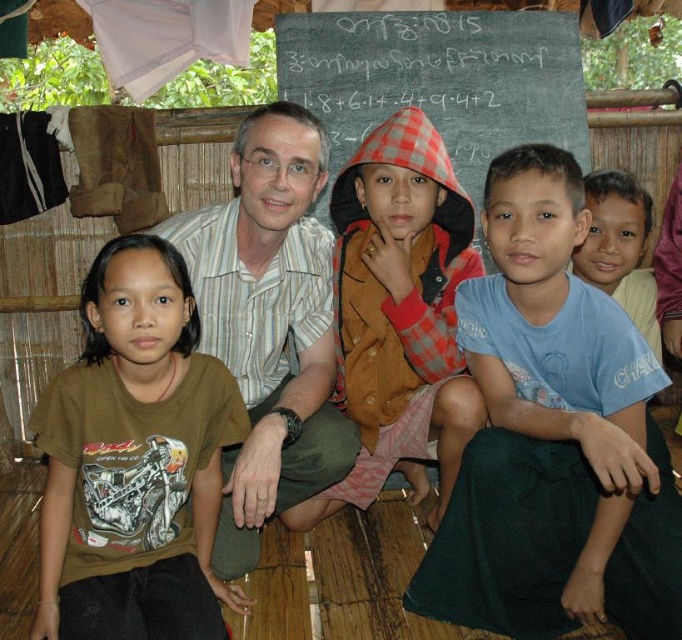
Which is above, blue cotton shirt at center or brown cotton t-shirt at left?

blue cotton shirt at center

Does blue cotton shirt at center have a greater width compared to brown cotton t-shirt at left?

Yes.

Who is more forward, (458, 499) or (72, 628)?

Point (72, 628) is more forward.

Find the location of `blue cotton shirt at center`. blue cotton shirt at center is located at coordinates (552, 436).

Between blue cotton shirt at center and blackboard at upper center, which one appears on the left side from the viewer's perspective?

blackboard at upper center

Where is `blue cotton shirt at center`? The height and width of the screenshot is (640, 682). blue cotton shirt at center is located at coordinates (552, 436).

Who is more forward, (666,609) or (385,77)?

Point (666,609) is in front.

The width and height of the screenshot is (682, 640). Identify the location of blue cotton shirt at center. (552, 436).

Which is more to the right, white striped shirt at center or blue cotton shirt at lower right?

blue cotton shirt at lower right is more to the right.

Does white striped shirt at center have a greater height compared to blue cotton shirt at lower right?

Indeed, white striped shirt at center has a greater height compared to blue cotton shirt at lower right.

At what (x,y) coordinates should I click in order to perform the action: click on white striped shirt at center. Please return your answer as a coordinate pair (x, y). This screenshot has width=682, height=640. Looking at the image, I should click on (269, 323).

This screenshot has width=682, height=640. What are the coordinates of `white striped shirt at center` in the screenshot? It's located at (269, 323).